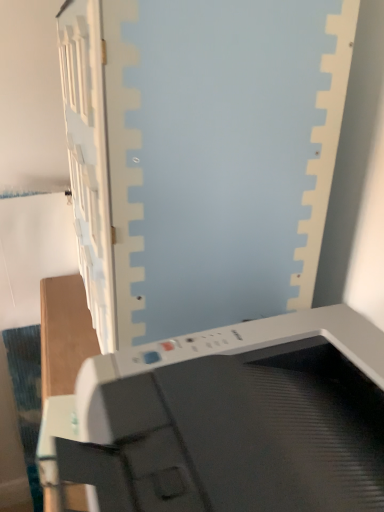
Describe the element at coordinates (228, 420) in the screenshot. I see `black rubber treadmill at lower center` at that location.

In order to click on black rubber treadmill at lower center in this screenshot , I will do `click(228, 420)`.

Image resolution: width=384 pixels, height=512 pixels. Find the location of `black rubber treadmill at lower center`. black rubber treadmill at lower center is located at coordinates (228, 420).